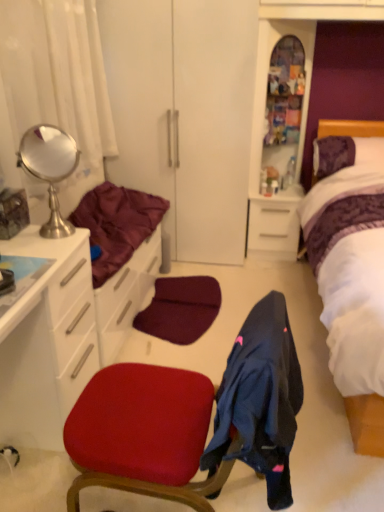
Question: Considering the positions of polished silver mirror at upper left and maroon satin blanket at left in the image, is polished silver mirror at upper left bigger or smaller than maroon satin blanket at left?

Choices:
 (A) small
 (B) big

Answer: (A)

Question: Does point (64, 134) appear closer or farther from the camera than point (109, 211)?

Choices:
 (A) farther
 (B) closer

Answer: (B)

Question: Based on their relative distances, which object is farther from the white sheer curtain at upper left?

Choices:
 (A) polished silver mirror at upper left
 (B) wooden cabinet at upper right
 (C) purple satin bed at right
 (D) velvet red chair at center
 (E) maroon satin blanket at left

Answer: (C)

Question: Which of these objects is positioned closest to the white sheer curtain at upper left?

Choices:
 (A) velvet red chair at center
 (B) white glossy cabinet at left
 (C) white glossy drawer at center
 (D) purple fabric headboard at upper right
 (E) maroon satin blanket at left

Answer: (E)